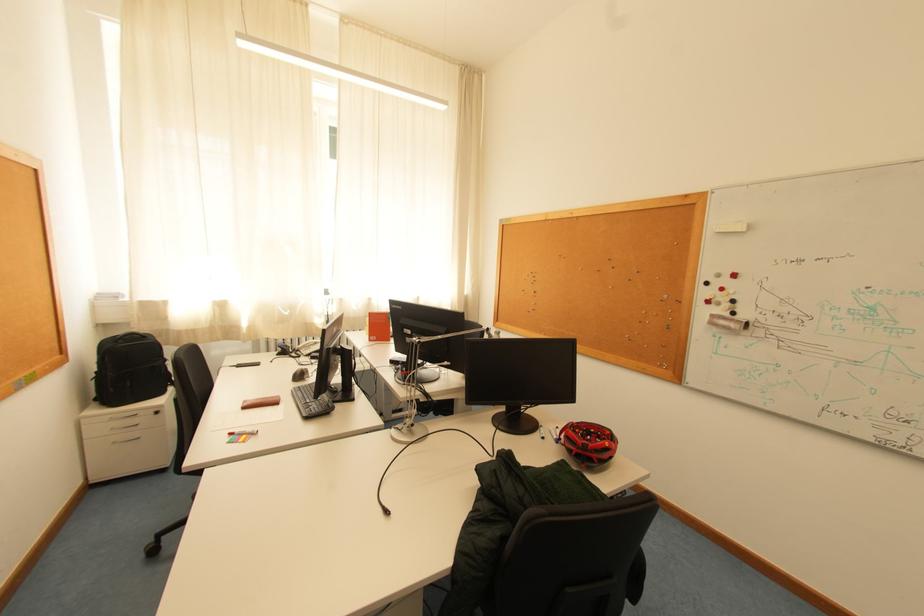
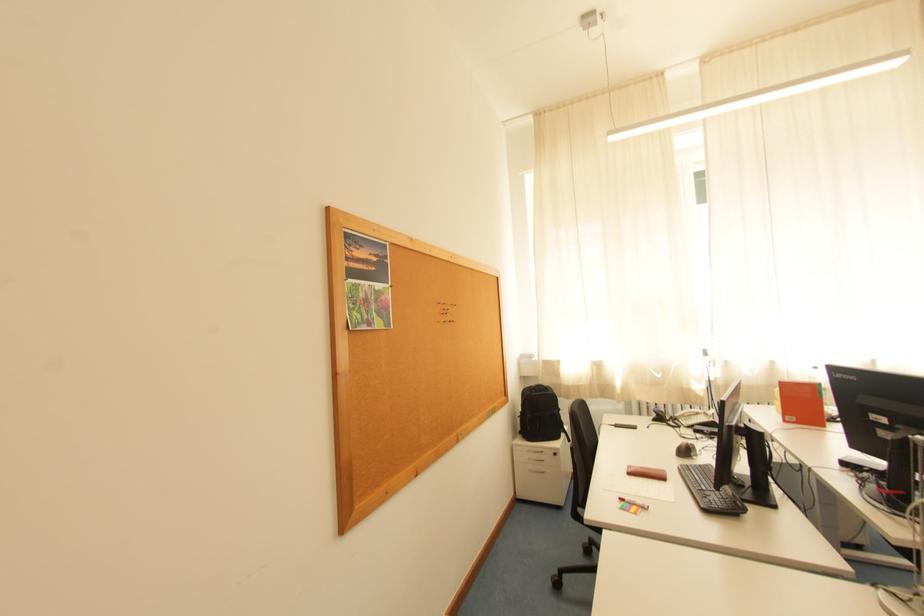
Locate, in the second image, the point that corresponds to point 307,374 in the first image.

(691, 448)